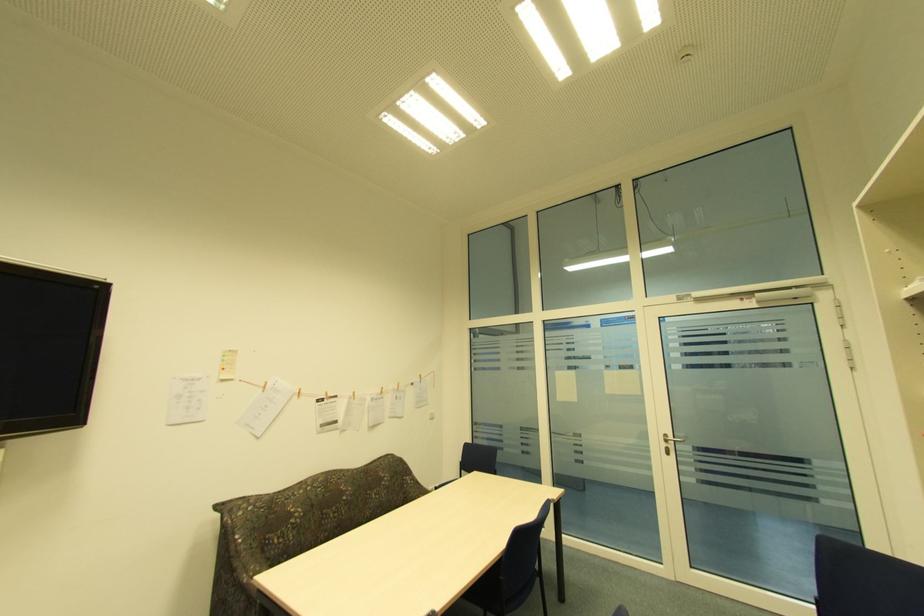
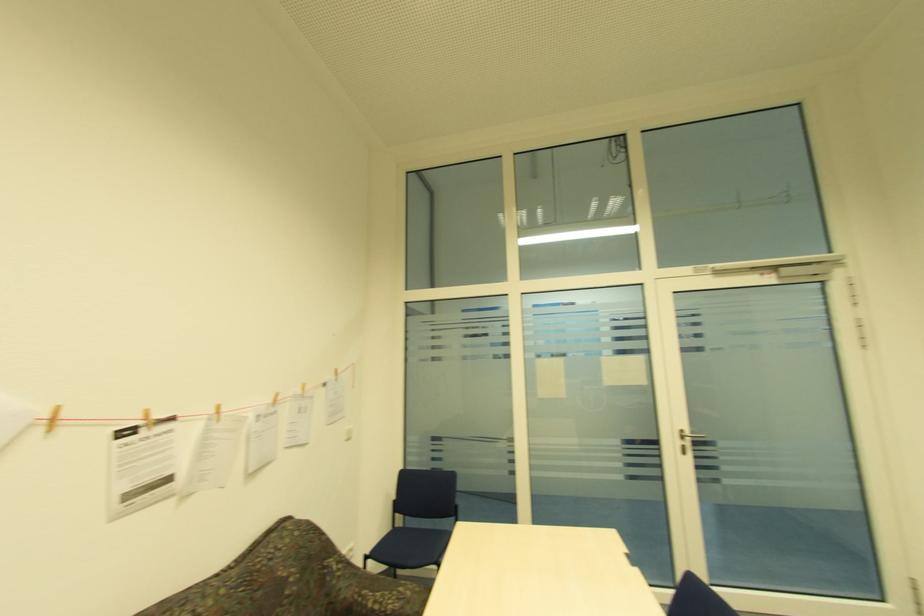
In the second image, find the point that corresponds to the point at 669,435 in the first image.

(685, 432)